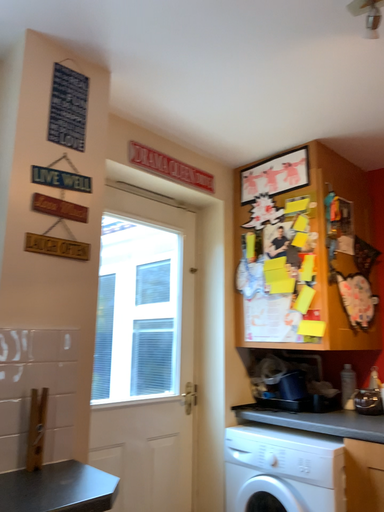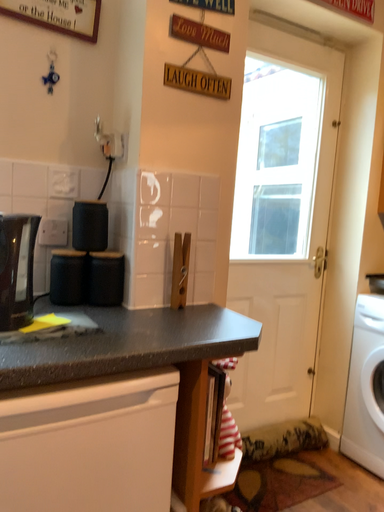
Question: Which way did the camera rotate in the video?

Choices:
 (A) rotated left
 (B) rotated right

Answer: (A)